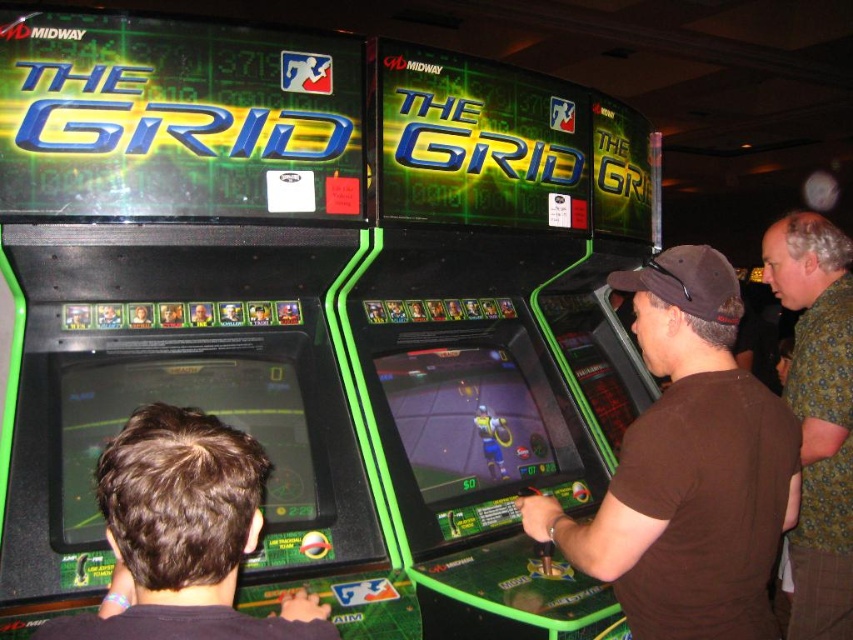
Question: Which point is closer to the camera taking this photo?

Choices:
 (A) (677, 429)
 (B) (74, 632)
 (C) (831, 340)

Answer: (B)

Question: Is brown cotton t-shirt at center closer to camera compared to brown matte hair at lower left?

Choices:
 (A) yes
 (B) no

Answer: (B)

Question: Is brown cotton t-shirt at center positioned at the back of green floral shirt at upper right?

Choices:
 (A) yes
 (B) no

Answer: (B)

Question: Among these objects, which one is farthest from the camera?

Choices:
 (A) brown cotton t-shirt at center
 (B) brown matte hair at lower left
 (C) green floral shirt at upper right

Answer: (C)

Question: Observing the image, what is the correct spatial positioning of brown matte hair at lower left in reference to green floral shirt at upper right?

Choices:
 (A) left
 (B) right

Answer: (A)

Question: Which object is farther from the camera taking this photo?

Choices:
 (A) brown matte hair at lower left
 (B) brown cotton t-shirt at center

Answer: (B)